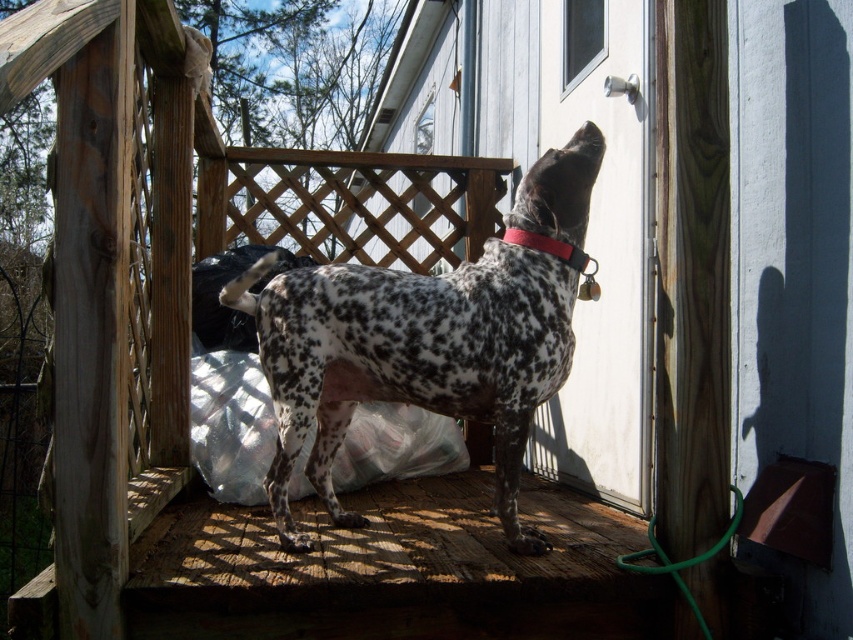
Consider the image. Who is taller, spotted fur dog at center or white glossy screen door at upper center?

white glossy screen door at upper center is taller.

Does spotted fur dog at center have a lesser height compared to white glossy screen door at upper center?

Indeed, spotted fur dog at center has a lesser height compared to white glossy screen door at upper center.

The image size is (853, 640). Describe the element at coordinates (409, 358) in the screenshot. I see `spotted fur dog at center` at that location.

Find the location of `spotted fur dog at center`. spotted fur dog at center is located at coordinates (409, 358).

Between spotted fur dog at center and red leather collar at upper center, which one has more height?

spotted fur dog at center

Image resolution: width=853 pixels, height=640 pixels. Find the location of `spotted fur dog at center`. spotted fur dog at center is located at coordinates (409, 358).

Looking at this image, is white glossy screen door at upper center smaller than red leather collar at upper center?

No.

Is white glossy screen door at upper center bigger than red leather collar at upper center?

Yes, white glossy screen door at upper center is bigger than red leather collar at upper center.

Describe the element at coordinates (592, 227) in the screenshot. I see `white glossy screen door at upper center` at that location.

The width and height of the screenshot is (853, 640). Find the location of `white glossy screen door at upper center`. white glossy screen door at upper center is located at coordinates (592, 227).